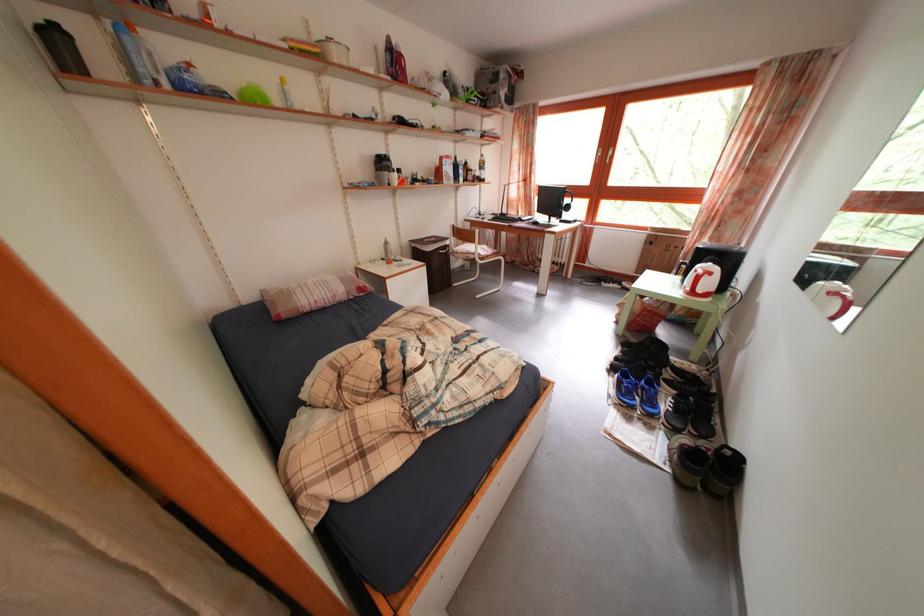
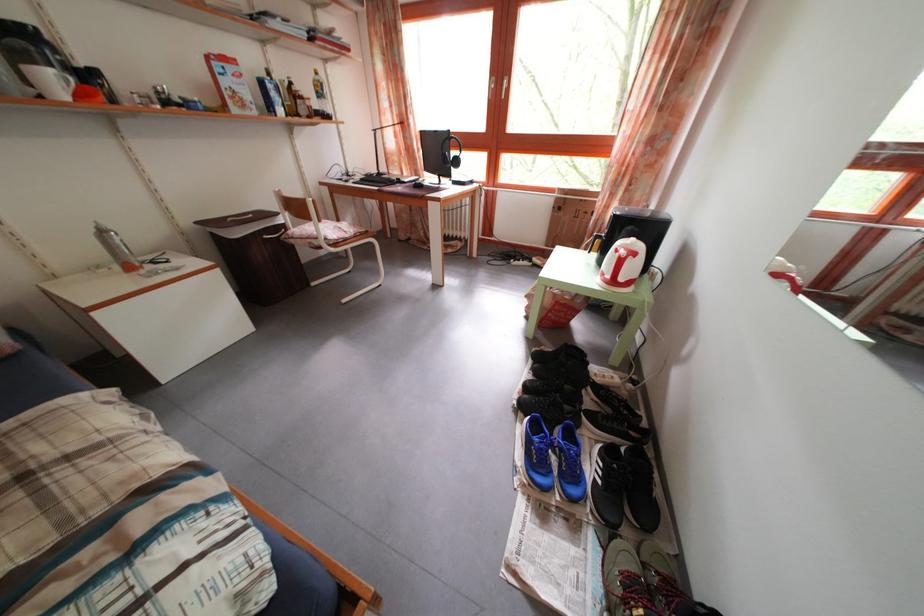
In the second image, find the point that corresponds to the point at 631,382 in the first image.

(542, 435)